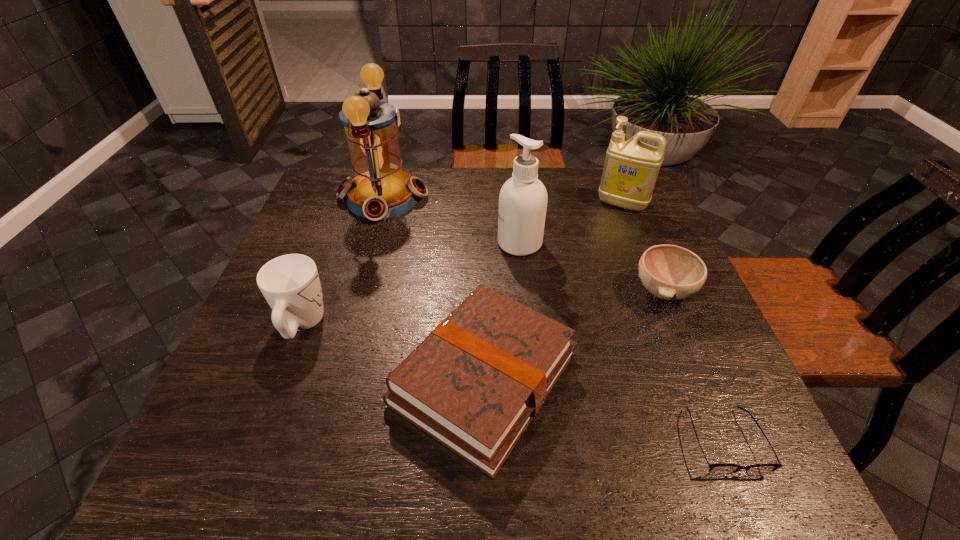
You are a GUI agent. You are given a task and a screenshot of the screen. Output one action in this format:
    pyautogui.click(x=<x>, y=<y>)
    Task: Click on the hardback book at the near edge
    
    Given the screenshot: What is the action you would take?
    pyautogui.click(x=474, y=384)

You are a GUI agent. You are given a task and a screenshot of the screen. Output one action in this format:
    pyautogui.click(x=<x>, y=<y>)
    Task: Click on the spectacles that is at the near edge
    
    Given the screenshot: What is the action you would take?
    pyautogui.click(x=715, y=469)

Identify the location of lantern that is at the left edge. This screenshot has width=960, height=540. (380, 189).

Find the location of a particular element. mug located in the left edge section of the desktop is located at coordinates (290, 283).

The image size is (960, 540). What are the coordinates of `detergent present at the right edge` in the screenshot? It's located at (631, 168).

Find the location of a particular element. bowl that is positioned at the right edge is located at coordinates (670, 272).

This screenshot has width=960, height=540. Identify the location of spectacles present at the right edge. (715, 469).

Find the location of a particular element. The width and height of the screenshot is (960, 540). object that is at the far left corner is located at coordinates (380, 189).

This screenshot has height=540, width=960. I want to click on object at the far right corner, so click(x=631, y=168).

At what (x,y) coordinates should I click in order to perform the action: click on object that is at the near right corner. Please return your answer as a coordinate pair (x, y). The height and width of the screenshot is (540, 960). Looking at the image, I should click on (715, 469).